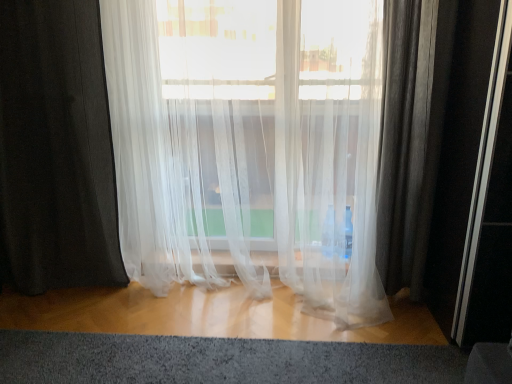
The image size is (512, 384). In order to click on vacant space in front of black sheer curtain at left, the second curtain when ordered from right to left in this screenshot , I will do `click(42, 325)`.